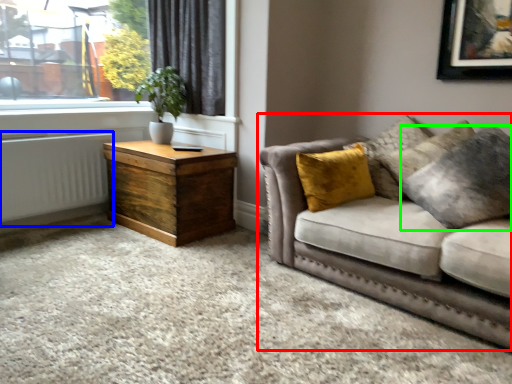
Question: Based on their relative distances, which object is farther from studio couch (highlighted by a red box)? Choose from radiator (highlighted by a blue box) and pillow (highlighted by a green box).

Choices:
 (A) radiator
 (B) pillow

Answer: (A)